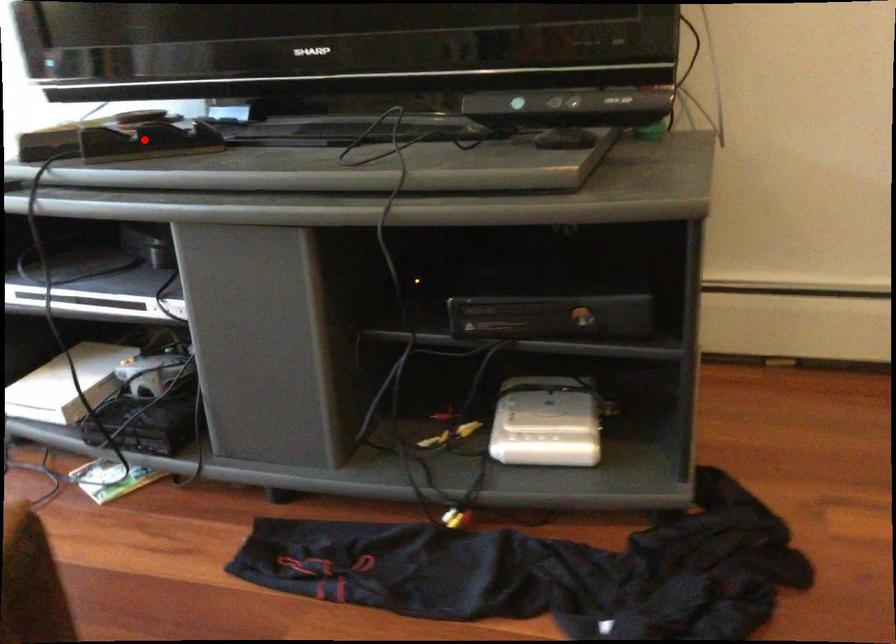
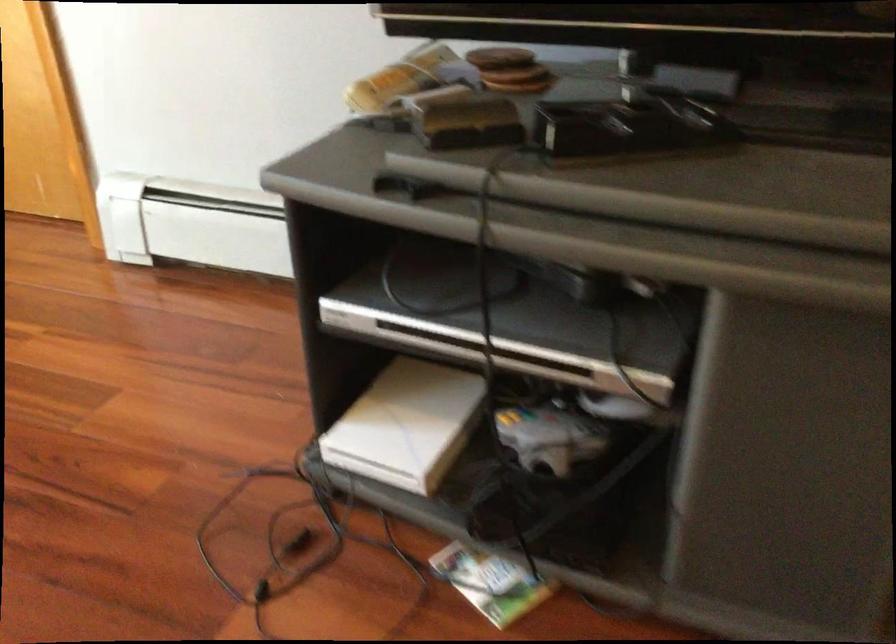
The point at the highlighted location is marked in the first image. Where is the corresponding point in the second image?

(627, 126)